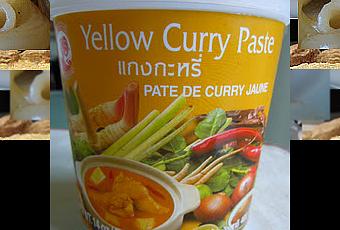
The image size is (340, 230). I want to click on bowl, so click(x=185, y=204).